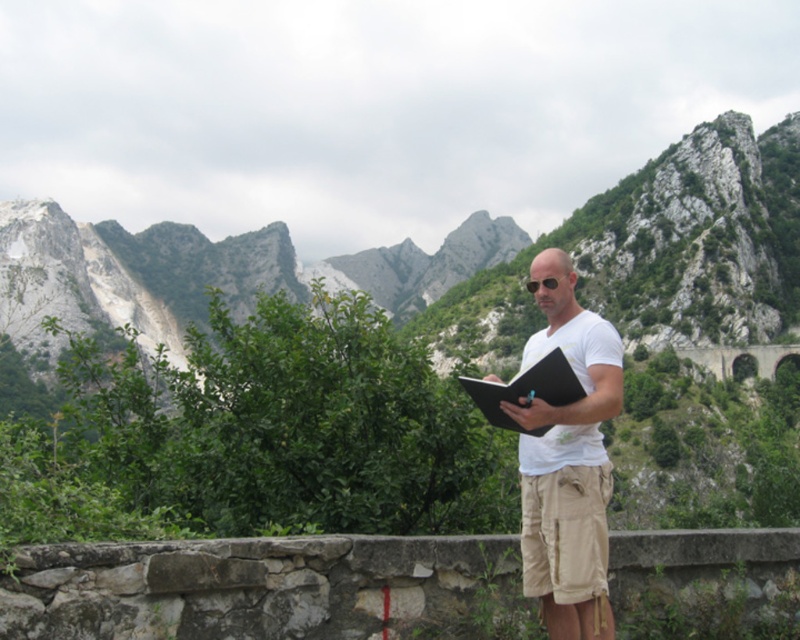
You are a hiker planning to cross a narrow mountain path. You have a backpack that is 4.5 meters long. You see the white cotton shirt at center and the tan cotton shorts at center in the image. Can your backpack fit between them without bending?

The white cotton shirt at center and tan cotton shorts at center are 5.00 meters apart. Since the backpack is 4.5 meters long, it can fit between them without bending.

You are a hiker who wants to take a photo of the rugged stone mountain at center and the black matte notebook at center. Which object should you focus on first if you want to capture both in a single frame without moving the camera?

You should focus on the rugged stone mountain at center first because it is taller than the black matte notebook at center, so it will require adjusting the camera settings to capture its height properly.

Consider the image. You are a hiker who needs to know which item is shorter between the tan cotton shorts at center and the black matte notebook at center. Can you tell me which one is shorter?

The tan cotton shorts at center is shorter than the black matte notebook at center according to the description.